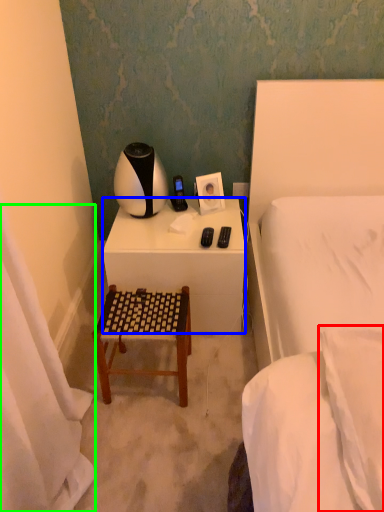
Question: Which is nearer to the pillow (highlighted by a red box)? desk (highlighted by a blue box) or curtain (highlighted by a green box).

Choices:
 (A) desk
 (B) curtain

Answer: (B)